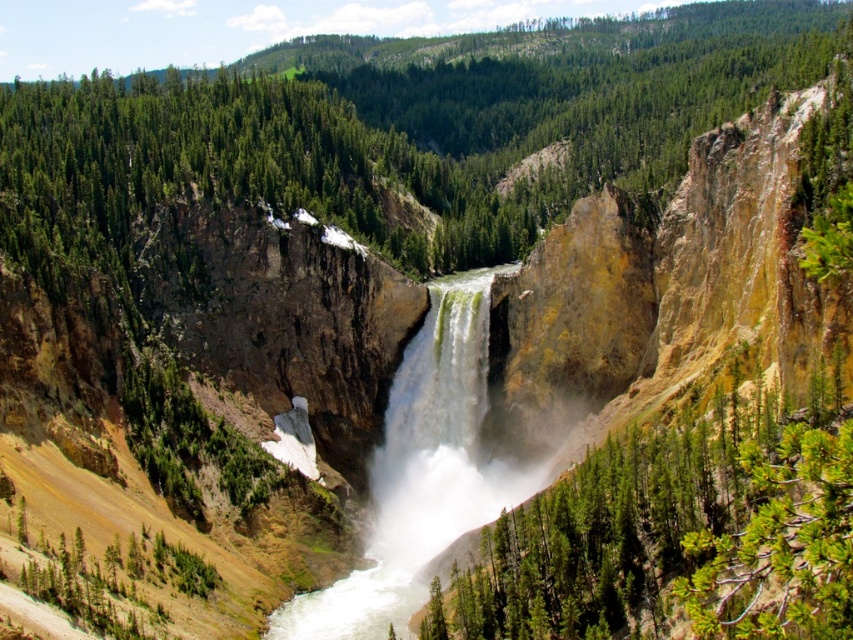
You are a hiker standing at the edge of the cliff overlooking the waterfall. You notice a green leafy tree at center and a white frothy water at center. Which one appears wider from your viewpoint?

The green leafy tree at center appears wider than the white frothy water at center because its width surpasses that of the white frothy water at center.

You are standing at the edge of the cliff overlooking the waterfall. You see the green leafy tree at center and the white frothy water at center. Which object is nearer to you?

A: The green leafy tree at center is closer to the viewer than the white frothy water at center.

You are standing at the base of the waterfall and see two points marked in the image. The first point is at coordinates point (773, 627) and the second is at point (363, 625). Which point is closer to you?

Point (773, 627) is in front of point (363, 625), so the first point is closer to you.